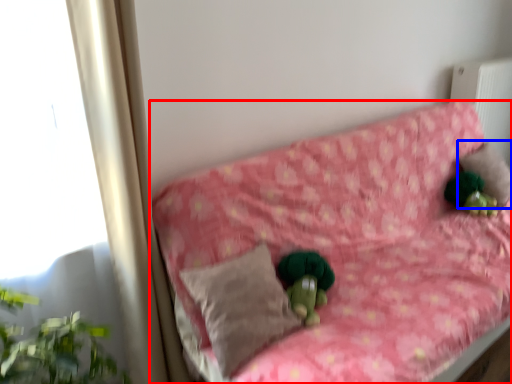
Question: Which object appears farthest to the camera in this image, furniture (highlighted by a red box) or pillow (highlighted by a blue box)?

Choices:
 (A) furniture
 (B) pillow

Answer: (B)